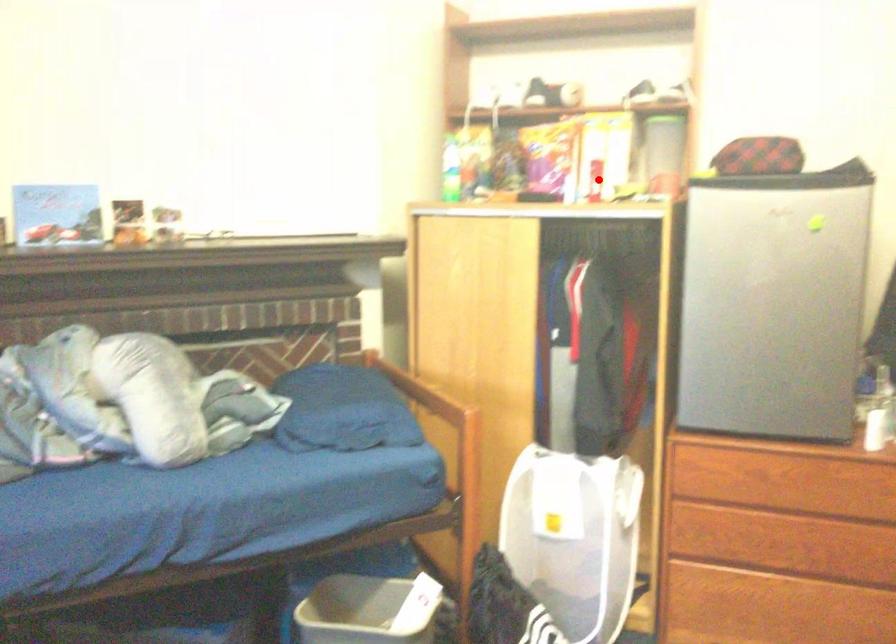
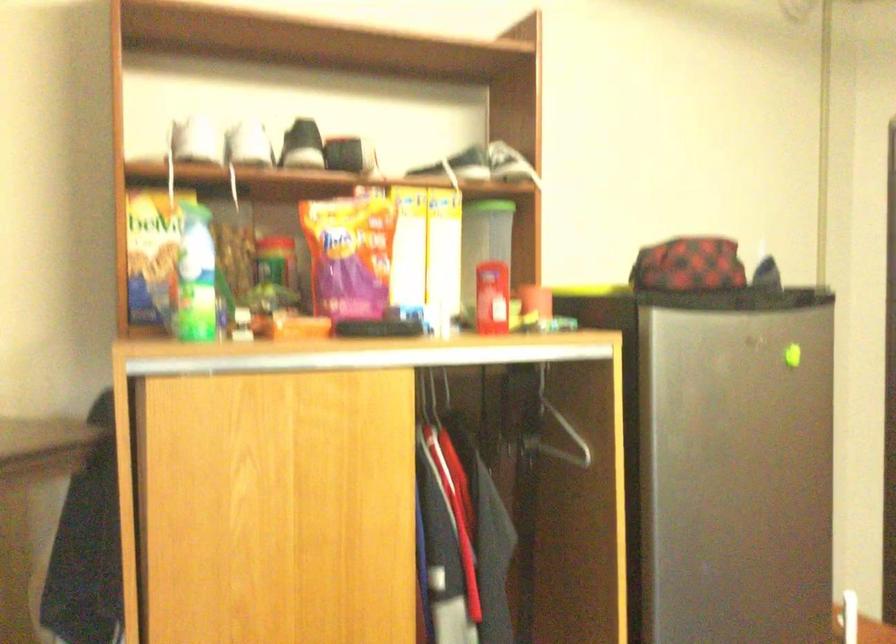
Question: I am providing you with two images of the same scene from different viewpoints. A red point is marked on the first image. At the location where the point appears in image 1, is it still visible in image 2?

Choices:
 (A) Yes
 (B) No

Answer: (A)